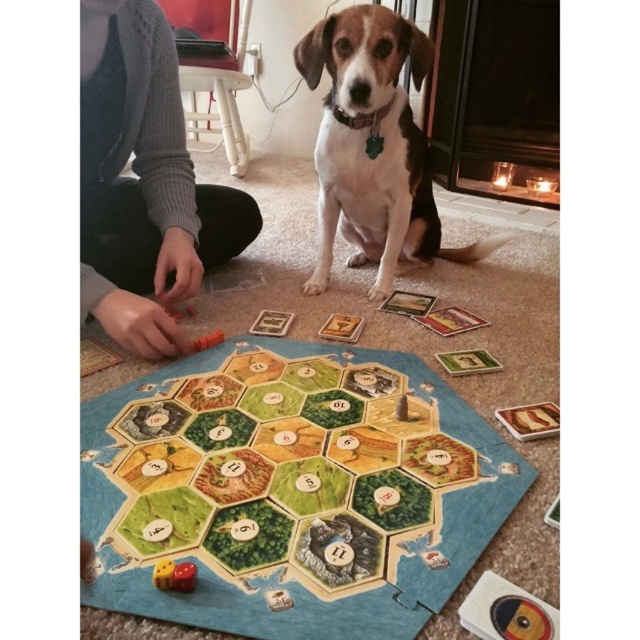
From the picture: Can you confirm if wooden hexagonal tiles at center is wider than brown and white fur dog at center?

Correct, the width of wooden hexagonal tiles at center exceeds that of brown and white fur dog at center.

Who is higher up, wooden hexagonal tiles at center or brown and white fur dog at center?

Positioned higher is brown and white fur dog at center.

Between point (387, 532) and point (388, 72), which one is positioned behind?

Point (388, 72)

In order to click on wooden hexagonal tiles at center in this screenshot , I will do `click(291, 490)`.